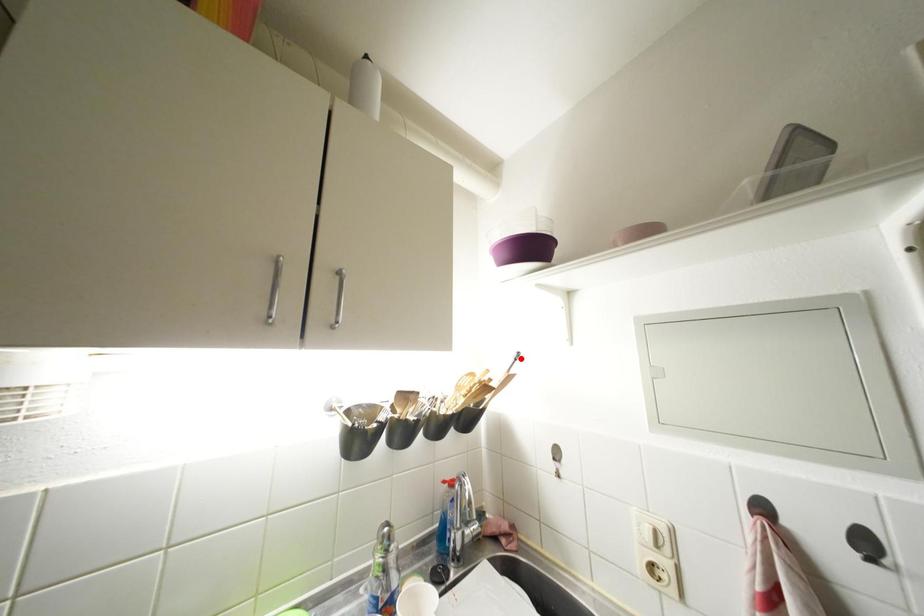
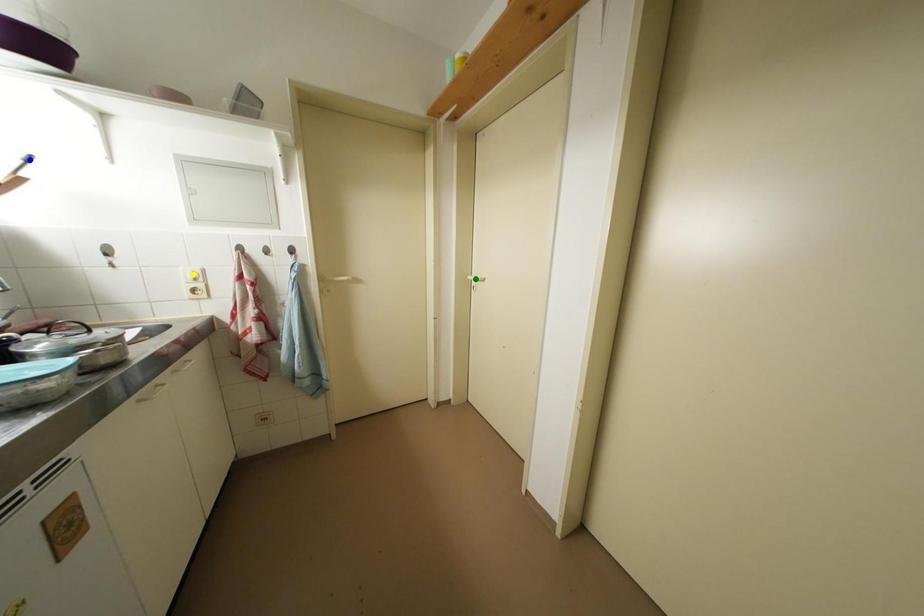
Question: I am providing you with two images of the same scene from different viewpoints. A red point is marked on the first image. You are given multiple points on the second image. Which point in image 2 is actually the same real-world point as the red point in image 1?

Choices:
 (A) green point
 (B) yellow point
 (C) blue point

Answer: (C)